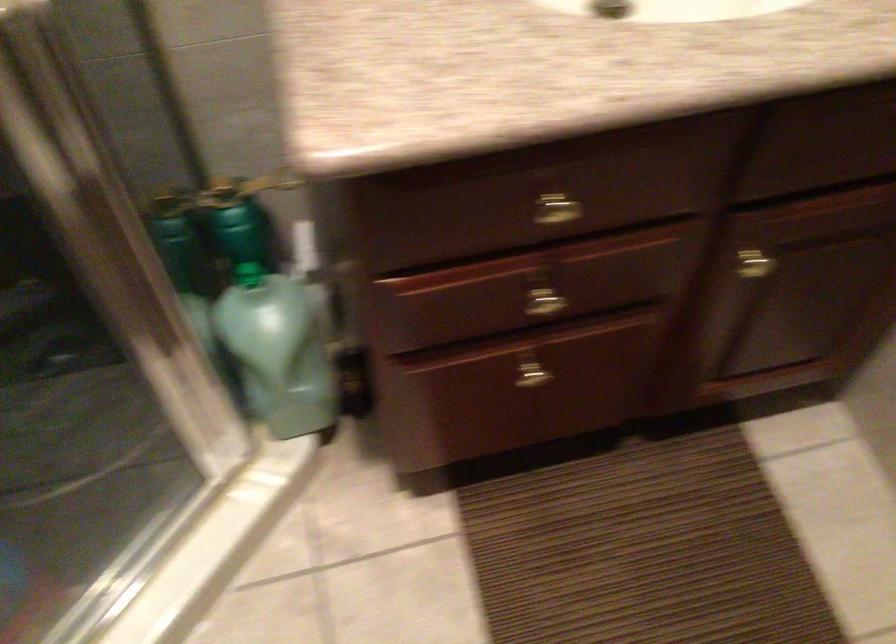
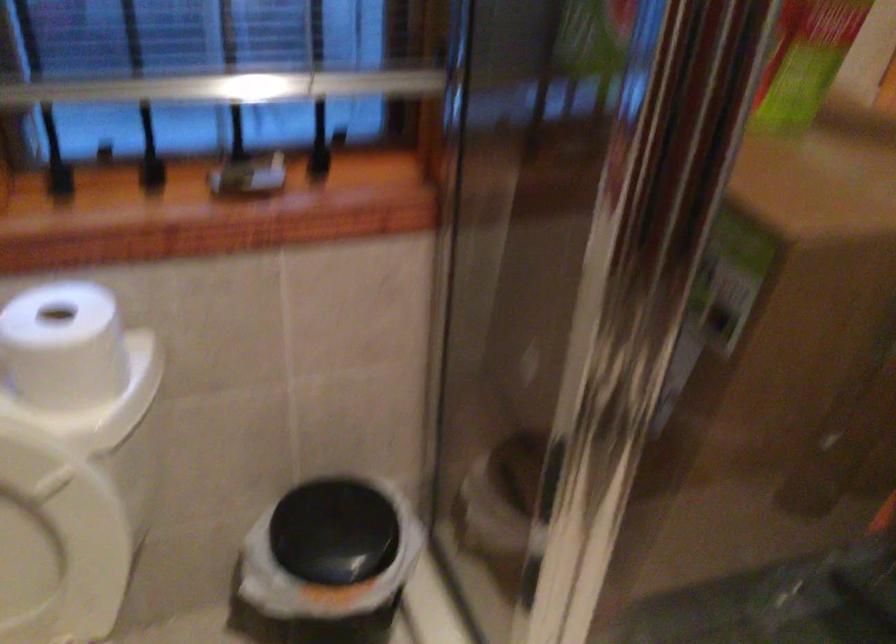
Question: The images are taken continuously from a first-person perspective. In which direction is your viewpoint rotating?

Choices:
 (A) Left
 (B) Right
 (C) Up
 (D) Down

Answer: (A)